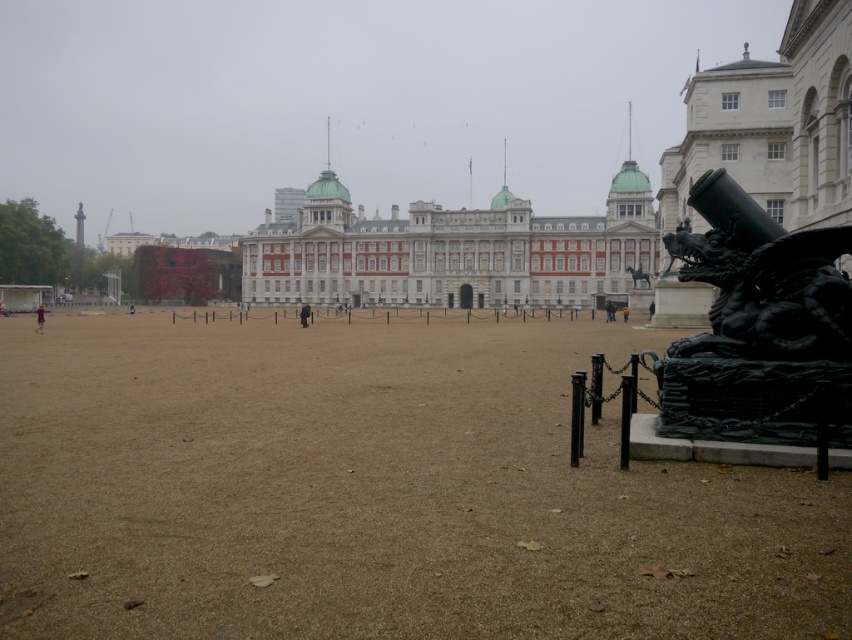
Does brown gravel at center appear under dark brown leather jacket at center?

Correct, brown gravel at center is located below dark brown leather jacket at center.

Can you confirm if brown gravel at center is positioned above dark brown leather jacket at center?

No, brown gravel at center is not above dark brown leather jacket at center.

Image resolution: width=852 pixels, height=640 pixels. I want to click on brown gravel at center, so click(x=377, y=492).

You are a GUI agent. You are given a task and a screenshot of the screen. Output one action in this format:
    pyautogui.click(x=<x>, y=<y>)
    Task: Click on the brown gravel at center
    Image resolution: width=852 pixels, height=640 pixels.
    Given the screenshot: What is the action you would take?
    pyautogui.click(x=377, y=492)

Between brown gravel at center and black matte person at center, which one appears on the left side from the viewer's perspective?

black matte person at center is more to the left.

In the scene shown: Is brown gravel at center bigger than black matte person at center?

Indeed, brown gravel at center has a larger size compared to black matte person at center.

This screenshot has height=640, width=852. I want to click on brown gravel at center, so click(377, 492).

The height and width of the screenshot is (640, 852). Describe the element at coordinates (758, 326) in the screenshot. I see `black polished stone dragon at lower right` at that location.

Is point (850, 300) farther from camera compared to point (41, 305)?

No, it is in front of (41, 305).

The height and width of the screenshot is (640, 852). What do you see at coordinates (758, 326) in the screenshot?
I see `black polished stone dragon at lower right` at bounding box center [758, 326].

Find the location of a particular element. black polished stone dragon at lower right is located at coordinates (758, 326).